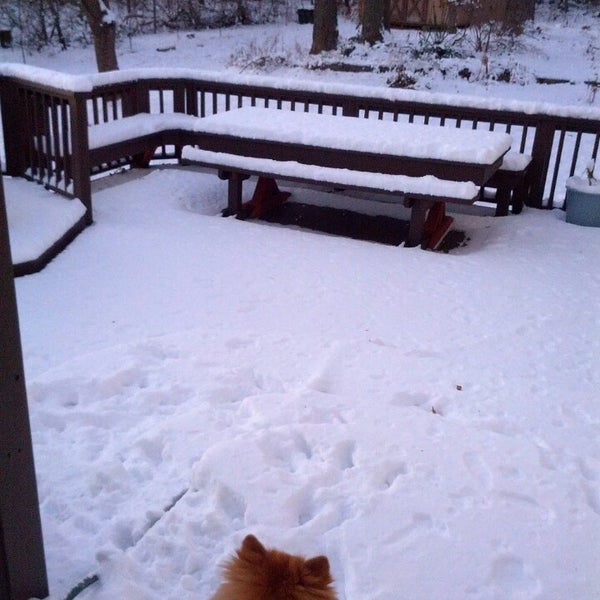
Image resolution: width=600 pixels, height=600 pixels. In order to click on bench in this screenshot , I will do `click(349, 187)`, `click(514, 166)`.